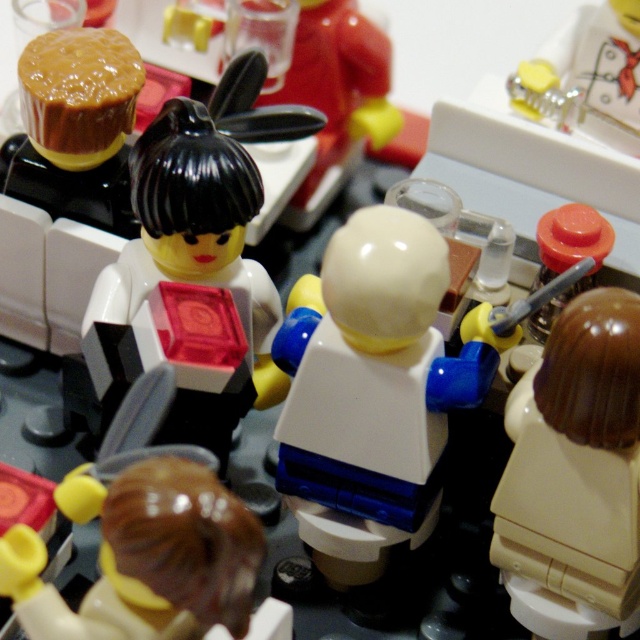
You are a LEGO designer trying to connect the translucent red cube at center with the brown glossy hair at lower left. The minimum distance required for the LEGO pieces to connect is 15 centimeters. Can you connect them directly without any additional pieces?

The translucent red cube at center is 18.60 centimeters away from brown glossy hair at lower left. Since the minimum distance required is 15 centimeters, the LEGO pieces can be connected directly without needing additional pieces because the distance is sufficient.

What are the coordinates of the translucent red cube at center?

The translucent red cube at center is located at coordinates point (186, 273).

You are a LEGO builder trying to assemble a scene. You have two main pieces to place first in the center area of the layout. The white plastic figure at center and the translucent red cube at center. According to the scene description, which one should you place first to the left to match the arrangement?

The white plastic figure at center is to the right of the translucent red cube at center, so you should place the translucent red cube at center first to the left, followed by the white plastic figure at center to its right to match the arrangement.